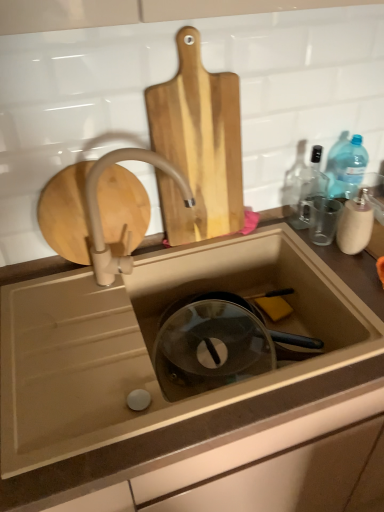
Where is `free space to the left of white matte faucet at upper center`? free space to the left of white matte faucet at upper center is located at coordinates (68, 297).